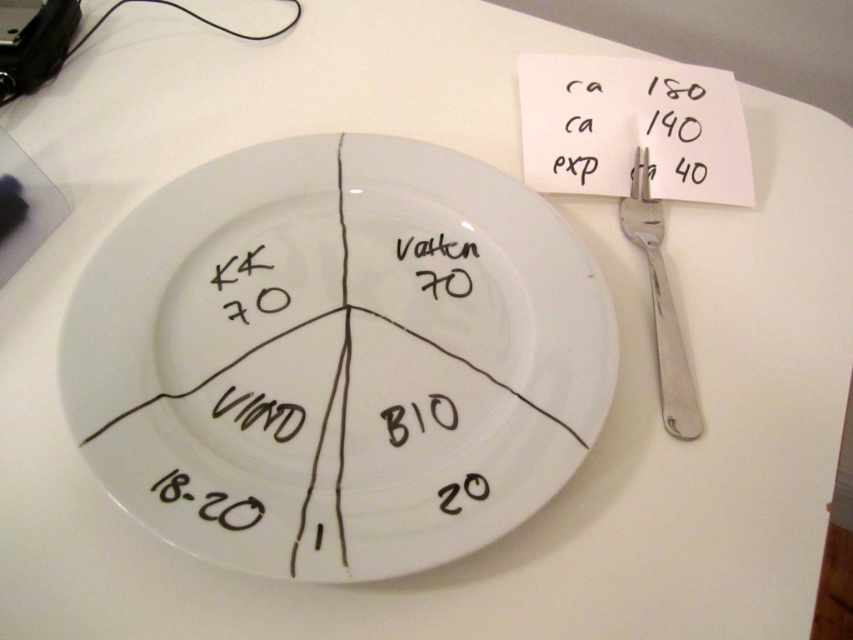
You are standing at the origin point of the table. The white ceramic plate at center is represented by point (335, 358). If you move 0.2 units to the right, will you be closer to or farther from the white ceramic plate at center?

Moving 0.2 units to the right from the origin would take you to the point 0.2, 0.0. The white ceramic plate at center is at (335, 358). The distance between these two points can be calculated using the distance formula. However, since the plate is located at a positive x and y coordinate, moving right increases your x coordinate but keeps your y the same. Since the plate is at x 0.561, moving to x 0.2 would actually move you away from the plate in the x direction. Wait, no, moving right from the origin to

Based on the photo, you are setting up a dining table and need to place a decorative napkin holder between the white paper at upper right and the satin silver fork at right. What is the minimum width of the napkin holder required to fit between them?

The distance between the white paper at upper right and the satin silver fork at right is 7.44 centimeters, so the napkin holder must be less than or equal to 7.44 centimeters wide to fit between them.

You are a diner at a restaurant and see the white ceramic plate on the table. You have a satin silver fork at right and want to use it to reach the white matte text at center. Can the fork reach the text without moving it?

The satin silver fork at right is much taller than the white matte text at center, so yes, the fork can reach the text without moving it.